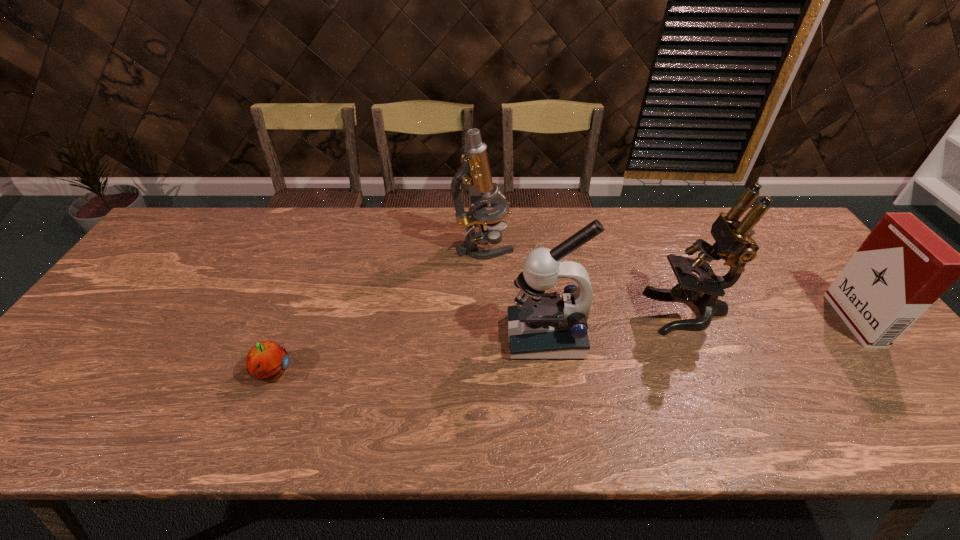
The image size is (960, 540). Find the location of `vacant region located on the front-facing side of the second shortest object`. vacant region located on the front-facing side of the second shortest object is located at coordinates (820, 320).

The image size is (960, 540). I want to click on vacant region located 0.180m on the front-facing side of the second shortest object, so click(774, 320).

Locate an element on the screen. The image size is (960, 540). vacant area situated 0.160m on the front-facing side of the second shortest object is located at coordinates (781, 320).

Find the location of `free spot located 0.250m on the left of the apple`. free spot located 0.250m on the left of the apple is located at coordinates (147, 374).

In order to click on object that is at the far edge in this screenshot , I will do `click(475, 170)`.

Locate an element on the screen. This screenshot has width=960, height=540. object that is positioned at the right edge is located at coordinates point(903,267).

The height and width of the screenshot is (540, 960). In the image, there is a desktop. In order to click on free space at the far edge in this screenshot , I will do `click(640, 234)`.

Image resolution: width=960 pixels, height=540 pixels. What are the coordinates of `blank space at the near edge` in the screenshot? It's located at (217, 442).

What are the coordinates of `free space at the left edge of the desktop` in the screenshot? It's located at (131, 343).

Locate an element on the screen. This screenshot has width=960, height=540. blank space at the right edge of the desktop is located at coordinates (845, 361).